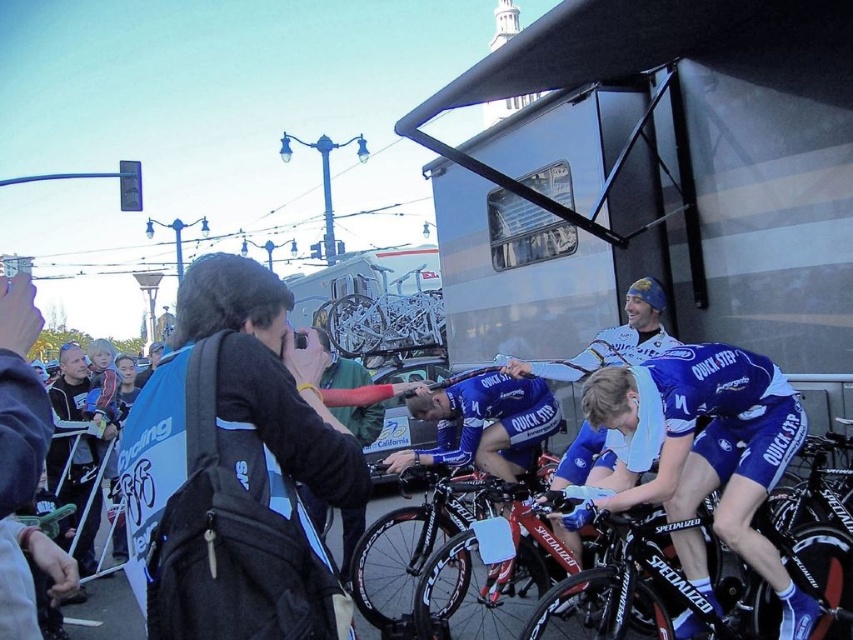
Is point (1, 484) behind point (660, 296)?

No, it is not.

Does point (16, 392) lie in front of point (653, 289)?

Yes, it is in front of point (653, 289).

Does point (20, 604) come closer to viewer compared to point (660, 301)?

Yes, it is.

This screenshot has width=853, height=640. I want to click on blue jersey at left, so click(x=22, y=465).

Which is behind, point (740, 52) or point (643, 289)?

Point (643, 289)

Can you confirm if silver metallic trailer at upper right is smaller than blue matte bicycle helmet at center?

Incorrect, silver metallic trailer at upper right is not smaller in size than blue matte bicycle helmet at center.

Does point (718, 333) lie in front of point (656, 308)?

That is True.

Image resolution: width=853 pixels, height=640 pixels. Identify the location of silver metallic trailer at upper right. (715, 150).

Who is higher up, silver metallic trailer at upper right or blue jersey at center?

Positioned higher is silver metallic trailer at upper right.

Who is more forward, (502, 180) or (775, 396)?

Point (775, 396) is in front.

At what (x,y) coordinates should I click in order to perform the action: click on silver metallic trailer at upper right. Please return your answer as a coordinate pair (x, y). This screenshot has height=640, width=853. Looking at the image, I should click on (715, 150).